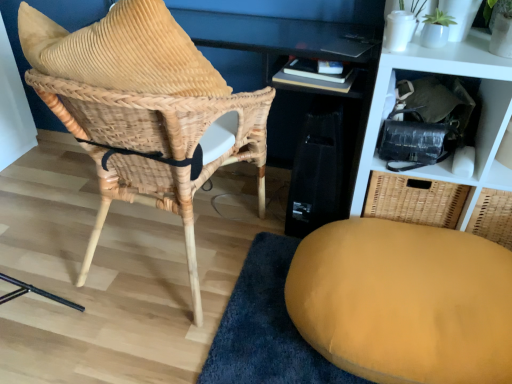
Question: Is woven rattan chair at left closer to camera compared to woven wicker basket at upper right?

Choices:
 (A) yes
 (B) no

Answer: (A)

Question: From a real-world perspective, is woven rattan chair at left located beneath woven wicker basket at upper right?

Choices:
 (A) yes
 (B) no

Answer: (B)

Question: Does woven rattan chair at left appear on the right side of woven wicker basket at upper right?

Choices:
 (A) yes
 (B) no

Answer: (B)

Question: Is woven rattan chair at left facing away from woven wicker basket at upper right?

Choices:
 (A) no
 (B) yes

Answer: (A)

Question: Would you say woven rattan chair at left is a long distance from woven wicker basket at upper right?

Choices:
 (A) yes
 (B) no

Answer: (B)

Question: Do you think woven wicker basket at upper right is within woven rattan chair at left, or outside of it?

Choices:
 (A) inside
 (B) outside

Answer: (B)

Question: Is point (459, 54) positioned closer to the camera than point (189, 193)?

Choices:
 (A) farther
 (B) closer

Answer: (B)

Question: Based on their sizes in the image, would you say woven wicker basket at upper right is bigger or smaller than woven rattan chair at left?

Choices:
 (A) big
 (B) small

Answer: (B)

Question: In terms of width, does woven wicker basket at upper right look wider or thinner when compared to woven rattan chair at left?

Choices:
 (A) thin
 (B) wide

Answer: (A)

Question: From the image's perspective, is woven rattan chair at left located above or below woven wicker basket at upper right?

Choices:
 (A) above
 (B) below

Answer: (B)

Question: Looking at their shapes, would you say woven rattan chair at left is wider or thinner than woven wicker basket at upper right?

Choices:
 (A) thin
 (B) wide

Answer: (B)

Question: From a real-world perspective, is woven rattan chair at left positioned above or below woven wicker basket at upper right?

Choices:
 (A) below
 (B) above

Answer: (B)

Question: Is point (184, 110) closer or farther from the camera than point (410, 61)?

Choices:
 (A) closer
 (B) farther

Answer: (A)

Question: Is woven rattan chair at left wider or thinner than velvet yellow ottoman at lower right?

Choices:
 (A) wide
 (B) thin

Answer: (B)

Question: Does point (234, 150) appear closer or farther from the camera than point (436, 263)?

Choices:
 (A) farther
 (B) closer

Answer: (A)